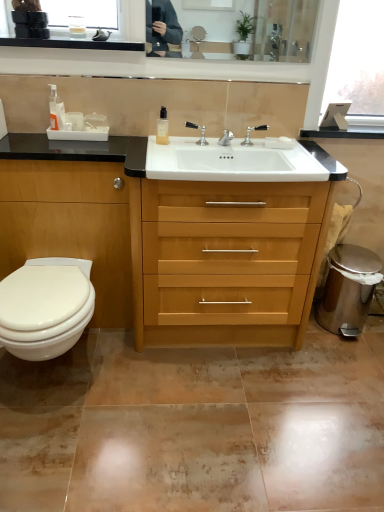
Question: Relative to polished chrome faucet at center, is light wood/finish chest of drawers at center in front or behind?

Choices:
 (A) front
 (B) behind

Answer: (A)

Question: In terms of height, does light wood/finish chest of drawers at center look taller or shorter compared to polished chrome faucet at center?

Choices:
 (A) short
 (B) tall

Answer: (B)

Question: Based on their relative distances, which object is nearer to the clear glass bottle at center, placed as the second toiletry when sorted from left to right?

Choices:
 (A) white glossy toilet at lower left
 (B) polished chrome faucet at center
 (C) light wood/finish chest of drawers at center
 (D) translucent plastic bottle at upper left, acting as the second toiletry starting from the right
 (E) polished silver faucet at center

Answer: (E)

Question: Which object is the closest to the translucent plastic bottle at upper left, marked as the first toiletry in a left-to-right arrangement?

Choices:
 (A) polished silver faucet at center
 (B) white glossy toilet at lower left
 (C) light wood/finish chest of drawers at center
 (D) clear glass bottle at center, placed as the second toiletry when sorted from left to right
 (E) polished chrome faucet at center

Answer: (D)